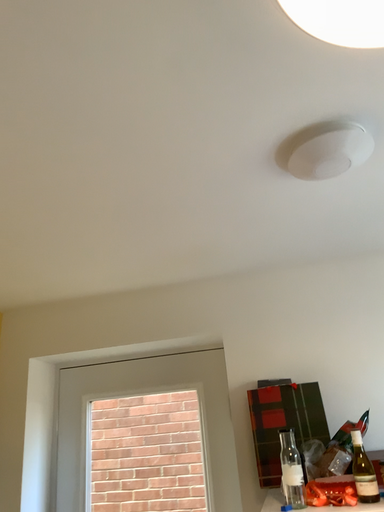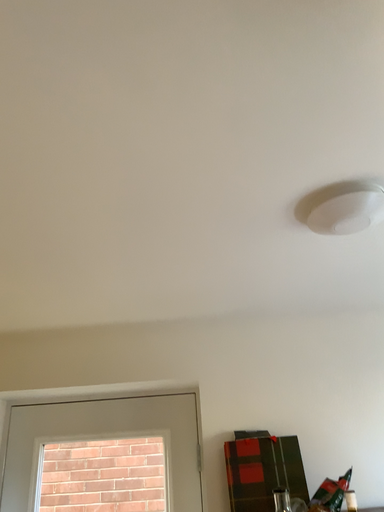
Question: How did the camera likely rotate when shooting the video?

Choices:
 (A) rotated left
 (B) rotated right

Answer: (B)